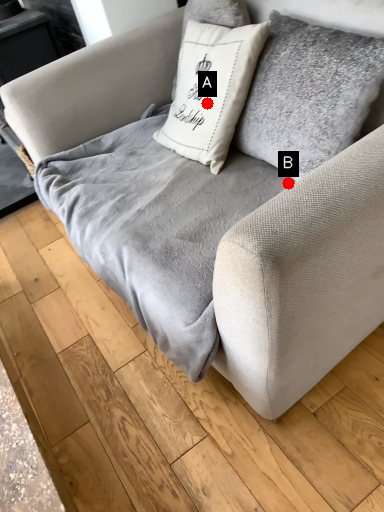
Question: Two points are circled on the image, labeled by A and B beside each circle. Which point is closer to the camera?

Choices:
 (A) A is closer
 (B) B is closer

Answer: (B)